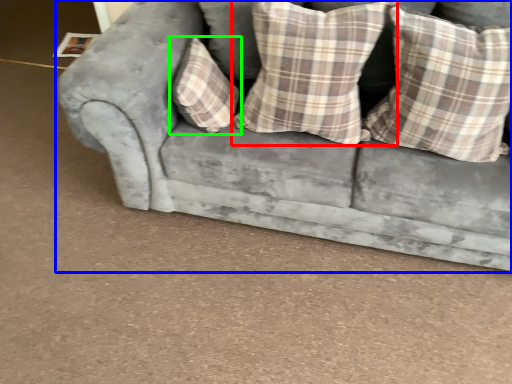
Question: Estimate the real-world distances between objects in this image. Which object is farther from pillow (highlighted by a red box), studio couch (highlighted by a blue box) or pillow (highlighted by a green box)?

Choices:
 (A) studio couch
 (B) pillow

Answer: (A)